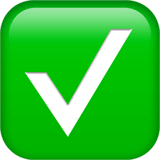
I want to click on rounded corners, so click(x=145, y=8), click(x=16, y=7).